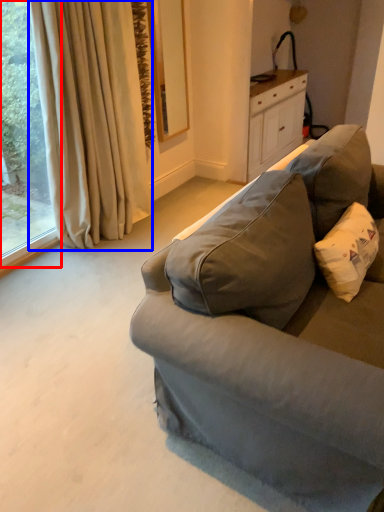
Question: Which of the following is the farthest to the observer, window (highlighted by a red box) or curtain (highlighted by a blue box)?

Choices:
 (A) window
 (B) curtain

Answer: (B)